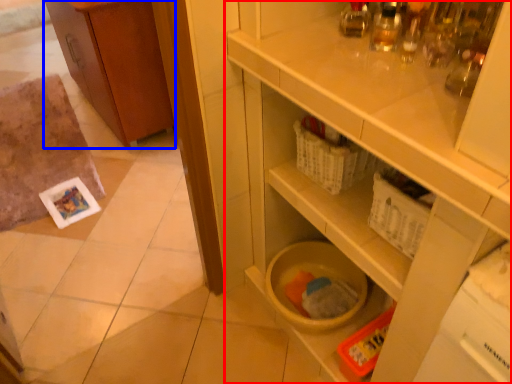
Question: Among these objects, which one is nearest to the camera, cupboard (highlighted by a red box) or cabinetry (highlighted by a blue box)?

Choices:
 (A) cupboard
 (B) cabinetry

Answer: (A)